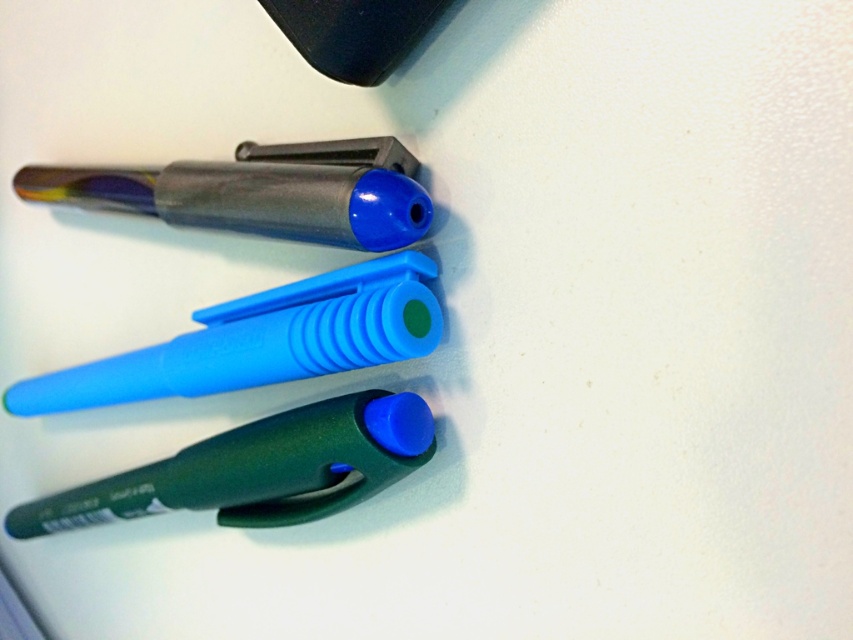
Question: Is translucent blue pen at center positioned behind green matte pen at lower center?

Choices:
 (A) no
 (B) yes

Answer: (A)

Question: Which point is farther from the camera taking this photo?

Choices:
 (A) (247, 502)
 (B) (22, 388)

Answer: (B)

Question: Among these objects, which one is farthest from the camera?

Choices:
 (A) green matte pen at lower center
 (B) translucent blue pen at center

Answer: (A)

Question: Does translucent blue pen at center have a greater width compared to green matte pen at lower center?

Choices:
 (A) no
 (B) yes

Answer: (B)

Question: Is translucent blue pen at center in front of green matte pen at lower center?

Choices:
 (A) yes
 (B) no

Answer: (A)